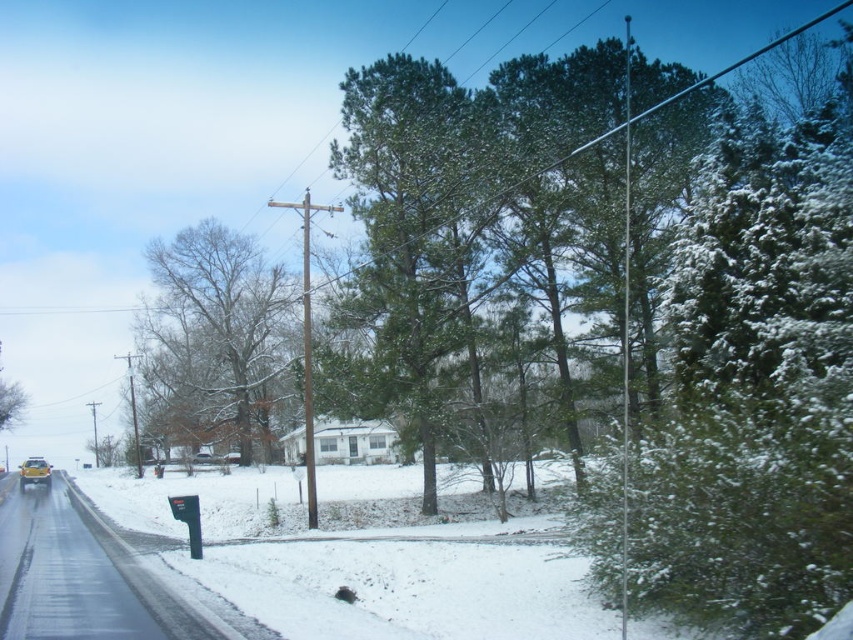
Question: Considering the real-world distances, which object is closest to the bare branches tree at center?

Choices:
 (A) green needle-like at center
 (B) yellow matte car at lower left

Answer: (B)

Question: Does green needle-like at center have a lesser width compared to yellow matte car at lower left?

Choices:
 (A) yes
 (B) no

Answer: (B)

Question: Is green needle-like at center below yellow matte car at lower left?

Choices:
 (A) no
 (B) yes

Answer: (A)

Question: Among these points, which one is farthest from the camera?

Choices:
 (A) (158, 404)
 (B) (364, 300)

Answer: (A)

Question: Can you confirm if green needle-like at center is positioned to the right of bare branches tree at center?

Choices:
 (A) no
 (B) yes

Answer: (B)

Question: Considering the real-world distances, which object is closest to the yellow matte car at lower left?

Choices:
 (A) green needle-like at center
 (B) bare branches tree at center

Answer: (B)